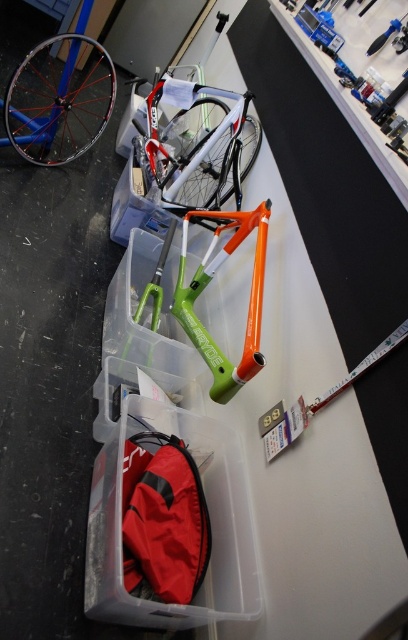
Could you measure the distance between transparent plastic bag at lower center and orange matte bicycle frame at center?

They are 17.13 inches apart.

Measure the distance between point (108, 611) and camera.

Point (108, 611) and camera are 3.68 feet apart.

Image resolution: width=408 pixels, height=640 pixels. Find the location of `transparent plastic bag at lower center`. transparent plastic bag at lower center is located at coordinates (210, 520).

Between point (175, 445) and point (168, 198), which one is positioned behind?

The point (168, 198) is more distant.

Is point (141, 554) closer to viewer compared to point (193, 92)?

Yes.

Between point (170, 552) and point (212, 131), which one is positioned behind?

Positioned behind is point (212, 131).

Find the location of a particular element. This screenshot has height=640, width=408. red fabric bag at lower left is located at coordinates (163, 520).

Which is above, matte white bicycle at upper center or orange matte bicycle frame at center?

matte white bicycle at upper center is above.

Identify the location of matte white bicycle at upper center. This screenshot has width=408, height=640. (199, 145).

Is point (177, 141) less distant than point (223, 387)?

No, (177, 141) is further to viewer.

This screenshot has width=408, height=640. What are the coordinates of `matte white bicycle at upper center` in the screenshot? It's located at (199, 145).